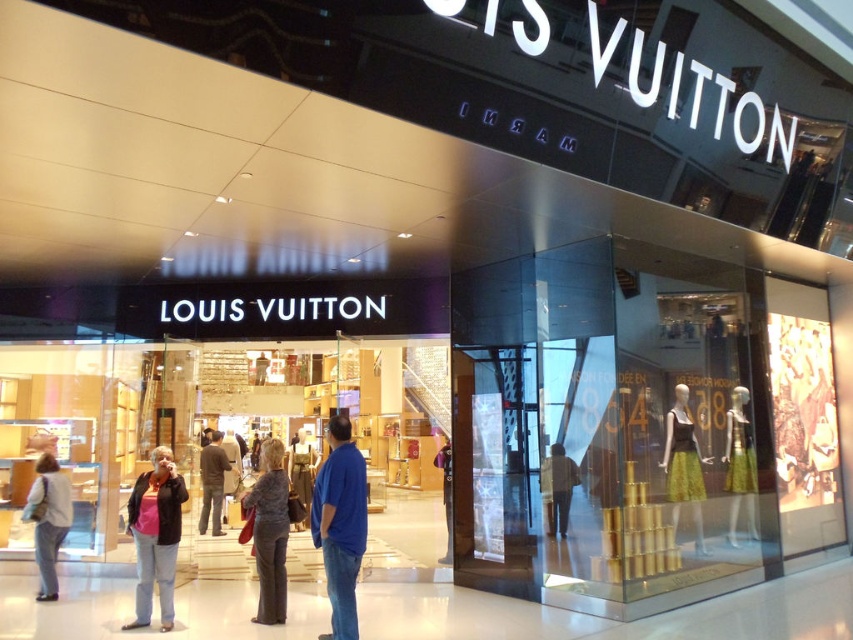
Question: Which point is closer to the camera?

Choices:
 (A) dark brown leather jacket at center
 (B) denim jacket at lower left

Answer: (B)

Question: Is the position of denim jacket at lower left less distant than that of dark gray fabric coat at center?

Choices:
 (A) yes
 (B) no

Answer: (A)

Question: Does yellow-green fabric dress at center have a greater width compared to green satin dress at right?

Choices:
 (A) no
 (B) yes

Answer: (B)

Question: Estimate the real-world distances between objects in this image. Which object is closer to the light gray jeans at lower left?

Choices:
 (A) green satin dress at right
 (B) dark gray fabric coat at center
 (C) dark brown leather jacket at center
 (D) light brown leather jacket at center

Answer: (B)

Question: Among these points, which one is farthest from the camera?

Choices:
 (A) (677, 499)
 (B) (281, 499)
 (C) (42, 481)

Answer: (A)

Question: Does blue denim jeans at center have a smaller size compared to denim jacket at lower left?

Choices:
 (A) yes
 (B) no

Answer: (B)